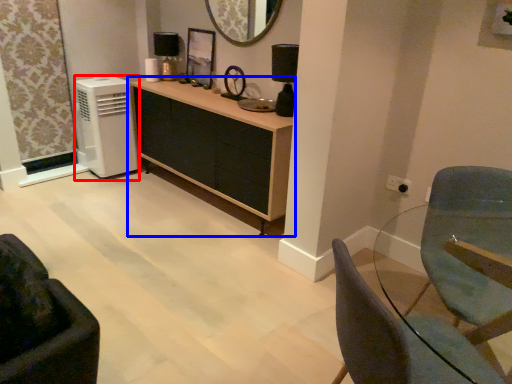
Question: Among these objects, which one is nearest to the camera, air conditioning (highlighted by a red box) or cabinetry (highlighted by a blue box)?

Choices:
 (A) air conditioning
 (B) cabinetry

Answer: (B)